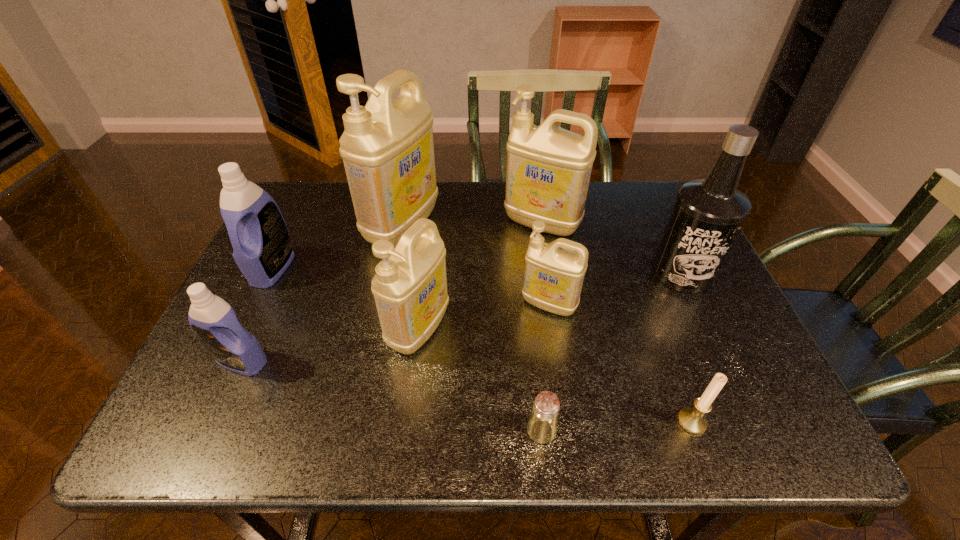
Locate an element on the screen. The height and width of the screenshot is (540, 960). detergent that is the closest one to the second biggest beige detergent is located at coordinates (553, 277).

Identify the location of detergent that is the fifth closest to the second biggest beige detergent. The width and height of the screenshot is (960, 540). (214, 322).

The image size is (960, 540). I want to click on the third closest beige detergent relative to the tallest detergent, so click(x=553, y=277).

I want to click on the fourth closest beige detergent to the nearer blue detergent, so click(x=548, y=171).